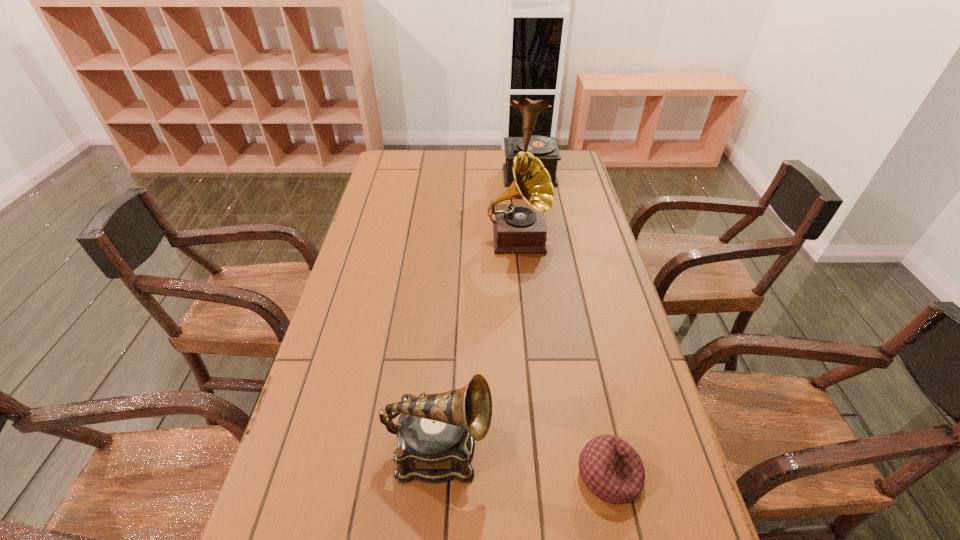
This screenshot has width=960, height=540. I want to click on phonograph record that stands as the second closest to the shortest phonograph record, so click(544, 148).

Identify which phonograph record is the second nearest to the second shortest object. Please provide its 2D coordinates. Your answer should be formatted as a tuple, i.e. [(x, y)], where the tuple contains the x and y coordinates of a point satisfying the conditions above.

[(544, 148)]

Find the location of a particular element. This screenshot has height=540, width=960. free location that satisfies the following two spatial constraints: 1. on the horn of the nearest phonograph record; 2. on the right side of the shortest object is located at coordinates (438, 475).

Where is `vacant region that satisfies the following two spatial constraints: 1. at the horn opening of the farthest object; 2. on the horn of the leftmost phonograph record`? vacant region that satisfies the following two spatial constraints: 1. at the horn opening of the farthest object; 2. on the horn of the leftmost phonograph record is located at coordinates [572, 449].

You are a GUI agent. You are given a task and a screenshot of the screen. Output one action in this format:
    pyautogui.click(x=<x>, y=<y>)
    Task: Click on the vacant space that satisfies the following two spatial constraints: 1. at the horn opening of the farthest phonograph record; 2. on the horn of the third tallest object
    
    Given the screenshot: What is the action you would take?
    pyautogui.click(x=572, y=449)

Find the location of a particular element. The image size is (960, 540). free space in the image that satisfies the following two spatial constraints: 1. from the horn of the third nearest object; 2. on the right side of the shortest object is located at coordinates (540, 475).

Identify the location of blank area in the image that satisfies the following two spatial constraints: 1. on the horn of the leftmost phonograph record; 2. on the left side of the shortest object. This screenshot has width=960, height=540. (438, 475).

Find the location of a particular element. This screenshot has width=960, height=540. vacant area that satisfies the following two spatial constraints: 1. at the horn opening of the farthest phonograph record; 2. on the right side of the beanbag is located at coordinates (576, 475).

Locate an element on the screen. The width and height of the screenshot is (960, 540). free location that satisfies the following two spatial constraints: 1. from the horn of the second farthest object; 2. on the right side of the shortest object is located at coordinates (540, 475).

This screenshot has width=960, height=540. I want to click on free space that satisfies the following two spatial constraints: 1. on the horn of the shortest phonograph record; 2. on the right side of the shortest object, so click(438, 475).